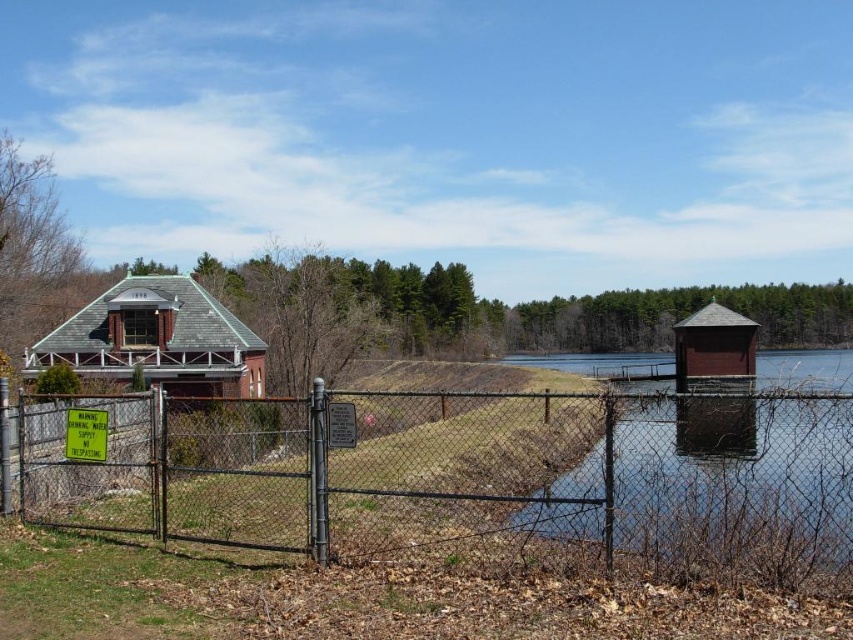
Is green plastic sign at center above white plastic sign at center?

Incorrect, green plastic sign at center is not positioned above white plastic sign at center.

Describe the element at coordinates (86, 435) in the screenshot. I see `green plastic sign at center` at that location.

Identify the location of green plastic sign at center. This screenshot has width=853, height=640. (86, 435).

Which is behind, point (701, 403) or point (352, 442)?

The point (352, 442) is behind.

The height and width of the screenshot is (640, 853). Identify the location of brown wooden dock at right. (732, 470).

At what (x,y) coordinates should I click in order to perform the action: click on brown wooden dock at right. Please return your answer as a coordinate pair (x, y). Looking at the image, I should click on (732, 470).

Is point (462, 426) closer to viewer compared to point (335, 438)?

That is False.

Is rusty chain-link fence at center above white plastic sign at center?

Actually, rusty chain-link fence at center is below white plastic sign at center.

Is point (564, 540) positioned before point (340, 422)?

Yes, point (564, 540) is closer to viewer.

This screenshot has height=640, width=853. What are the coordinates of `rusty chain-link fence at center` in the screenshot? It's located at (474, 477).